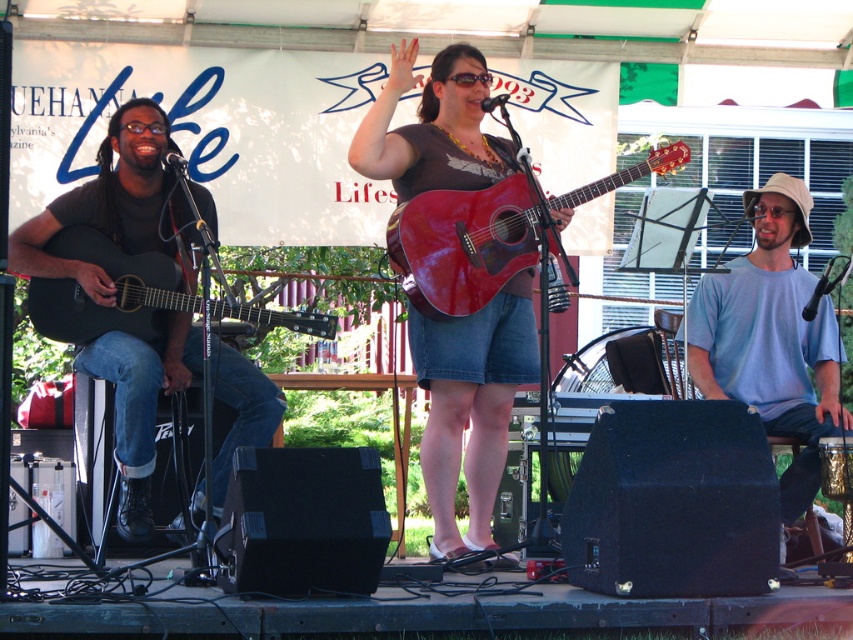
You are a stagehand who needs to move a 30 inch wide equipment box between the shiny red guitar at center and the matte black acoustic guitar at left. Can you fit the equipment box between them without moving the guitars?

The distance between the shiny red guitar at center and the matte black acoustic guitar at left is 28.95 inches. Since the equipment box is 30 inches wide, it cannot fit between them as the space is narrower than the box.

You are a stagehand who needs to store the shiny red guitar at center and the matte black acoustic guitar at left in a storage case. The case can only fit one guitar at a time. Which guitar should you store first to ensure it fits properly?

The shiny red guitar at center is smaller than the matte black acoustic guitar at left, so you should store the shiny red guitar at center first since it requires less space and can be placed in the case more easily.

You are a stagehand setting up a new microphone stand. The stand requires at least 40 inches of space between the matte black guitar at left and the glossy wood guitar at center to avoid knocking into either instrument. Is there enough space between them?

The matte black guitar at left is 33.80 inches from the glossy wood guitar at center, which is less than the required 40 inches. Therefore, there is not enough space to safely place the microphone stand between them without risking contact with the guitars.